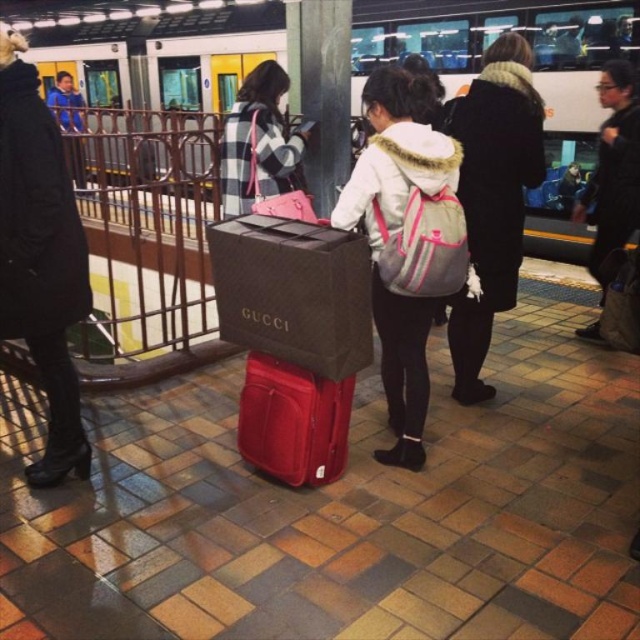
What are the coordinates of the matte black gucci bag at center in the image?

The coordinates of the matte black gucci bag at center are at point (292, 291).

You are a delivery robot with a package that needs to be placed between the matte black gucci bag at center and the black wool coat at center. The package requires at least 1 meter of space. Can you fit it there?

The distance between the matte black gucci bag at center and the black wool coat at center is 1.12 meters, so yes, the package can fit as the required space of 1 meter is met.